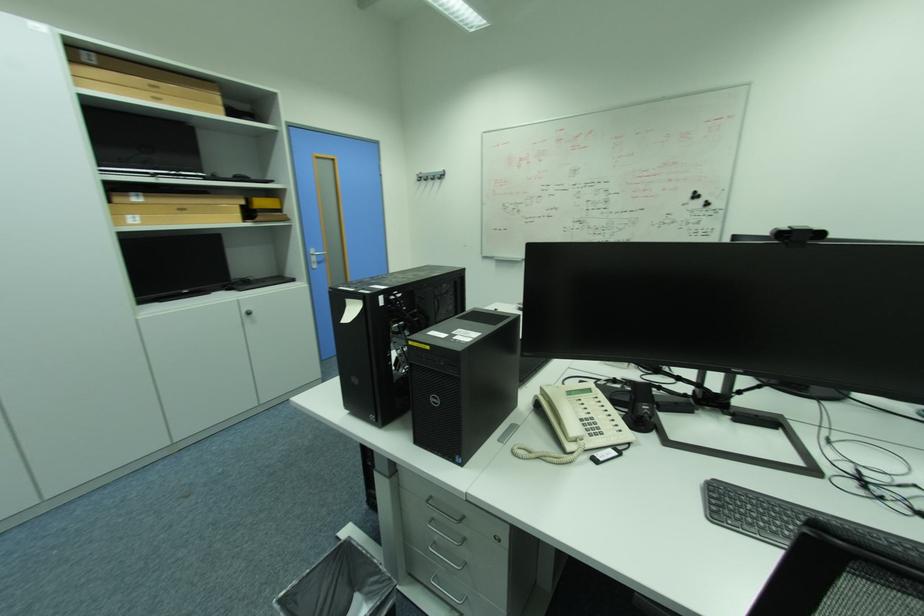
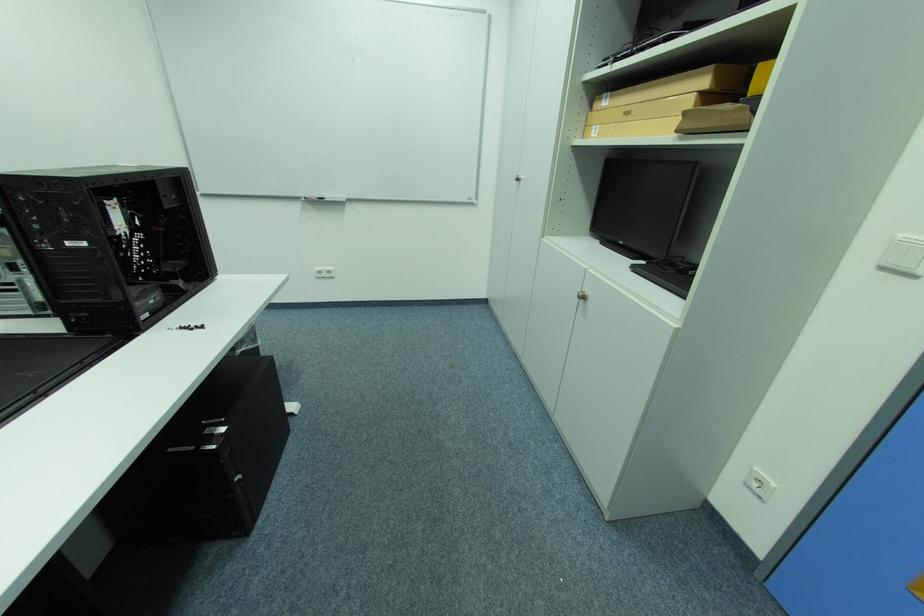
Find the pixel in the second image that matches the point at 136,217 in the first image.

(602, 128)